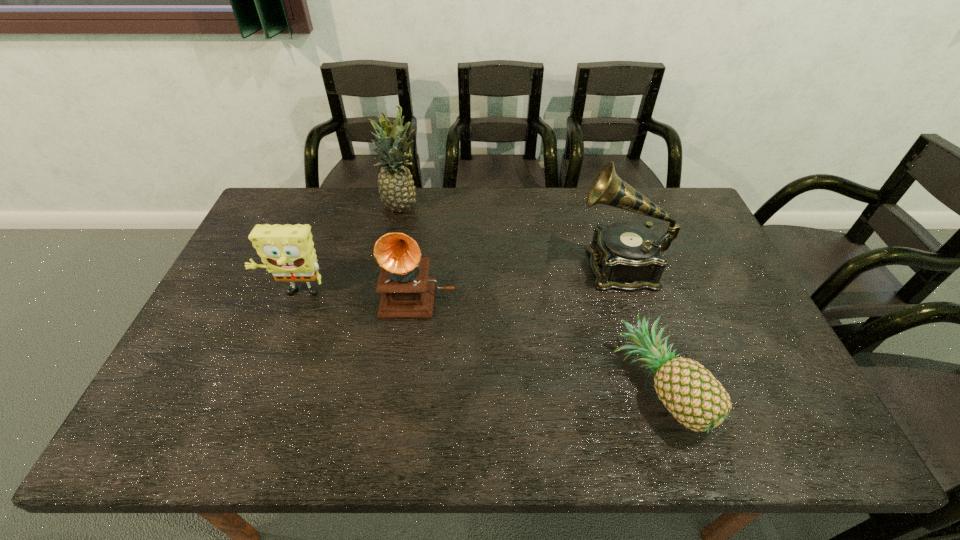
I want to click on vacant space that is in between the shortest object and the shorter phonograph record, so click(x=538, y=340).

Identify the location of free space that is in between the taller phonograph record and the farther pineapple. Image resolution: width=960 pixels, height=540 pixels. (511, 237).

Locate which object ranks third in proximity to the right pineapple. Please provide its 2D coordinates. Your answer should be formatted as a tuple, i.e. [(x, y)], where the tuple contains the x and y coordinates of a point satisfying the conditions above.

[(396, 188)]

Find the location of a particular element. This screenshot has height=540, width=960. object that is the fourth nearest to the shorter phonograph record is located at coordinates (689, 391).

Where is `free space that satisfies the following two spatial constraints: 1. on the face of the leftmost object; 2. on the left side of the nearest object`? free space that satisfies the following two spatial constraints: 1. on the face of the leftmost object; 2. on the left side of the nearest object is located at coordinates (259, 387).

Where is `free location that satisfies the following two spatial constraints: 1. on the horn of the nearer pineapple; 2. on the left side of the taller phonograph record`? This screenshot has height=540, width=960. free location that satisfies the following two spatial constraints: 1. on the horn of the nearer pineapple; 2. on the left side of the taller phonograph record is located at coordinates (657, 387).

The width and height of the screenshot is (960, 540). I want to click on free space that satisfies the following two spatial constraints: 1. on the horn of the right phonograph record; 2. on the face of the sponge, so click(628, 295).

Find the location of `free space in the image that satisfies the following two spatial constraints: 1. on the horn of the taller phonograph record; 2. on the left side of the shorter pineapple`. free space in the image that satisfies the following two spatial constraints: 1. on the horn of the taller phonograph record; 2. on the left side of the shorter pineapple is located at coordinates (657, 387).

Locate an element on the screen. This screenshot has width=960, height=540. free space that satisfies the following two spatial constraints: 1. on the horn of the right phonograph record; 2. on the horn of the left phonograph record is located at coordinates (628, 294).